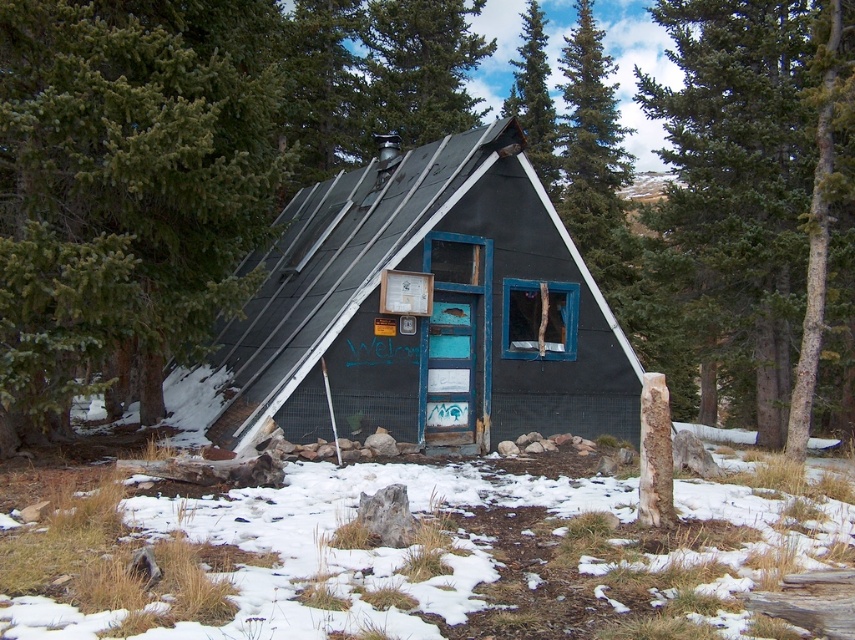
Is green leafy tree at upper center above green pine tree at upper center?

Correct, green leafy tree at upper center is located above green pine tree at upper center.

Who is more forward, (457, 92) or (522, 26)?

Point (457, 92)

Where is `green leafy tree at upper center`? This screenshot has width=855, height=640. green leafy tree at upper center is located at coordinates (420, 67).

Which of these two, matte black cabin at center or green leafy tree at upper center, stands taller?

With more height is green leafy tree at upper center.

Can you confirm if matte black cabin at center is taller than green leafy tree at upper center?

No, matte black cabin at center is not taller than green leafy tree at upper center.

Is point (476, 372) positioned before point (397, 97)?

That is True.

Identify the location of matte black cabin at center. (425, 317).

Between point (121, 125) and point (482, 44), which one is positioned in front?

Point (121, 125)

This screenshot has height=640, width=855. I want to click on green needle-like leaves at upper left, so click(x=127, y=189).